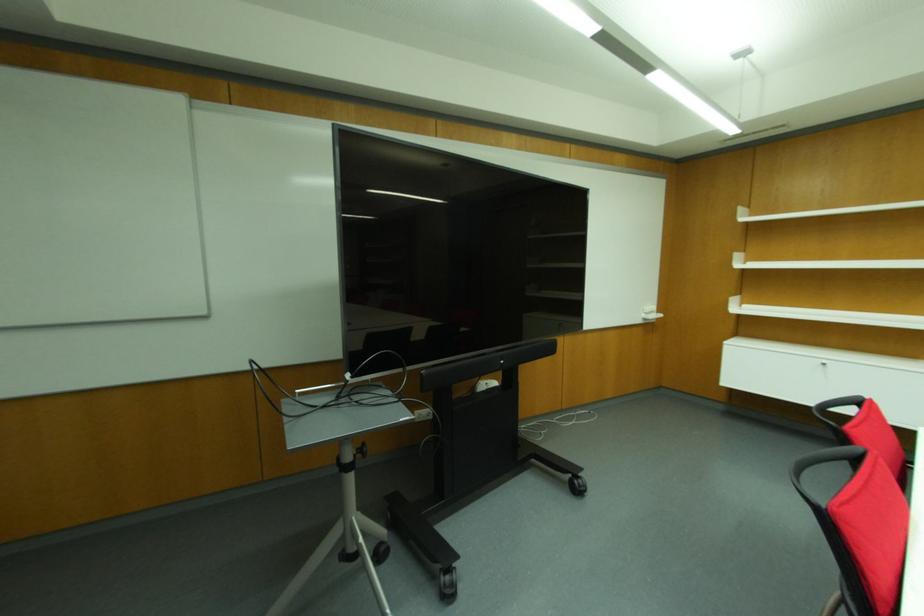
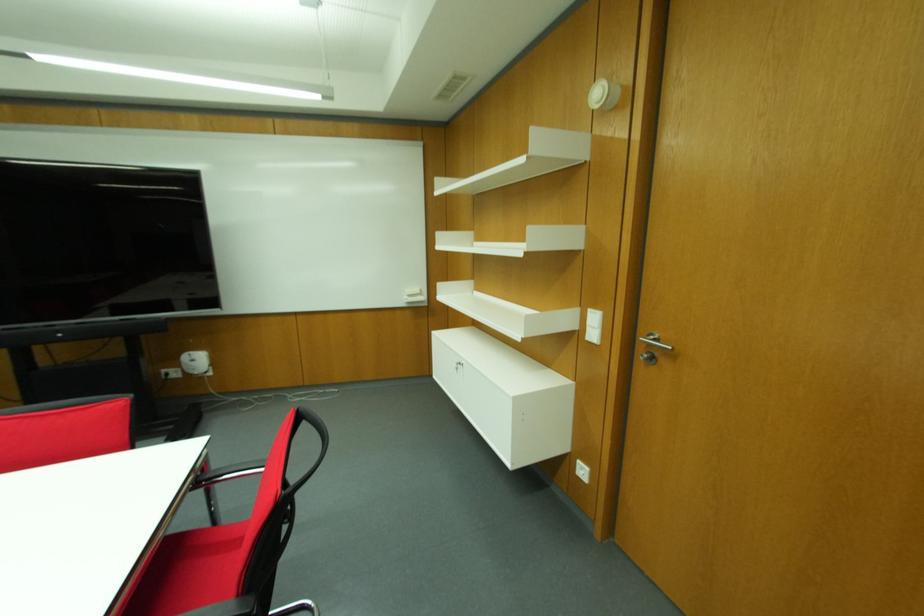
Question: Which direction would the cameraman need to move to produce the second image? Reply with the corresponding letter.

Choices:
 (A) Left
 (B) Right
 (C) Forward
 (D) Backward

Answer: (B)